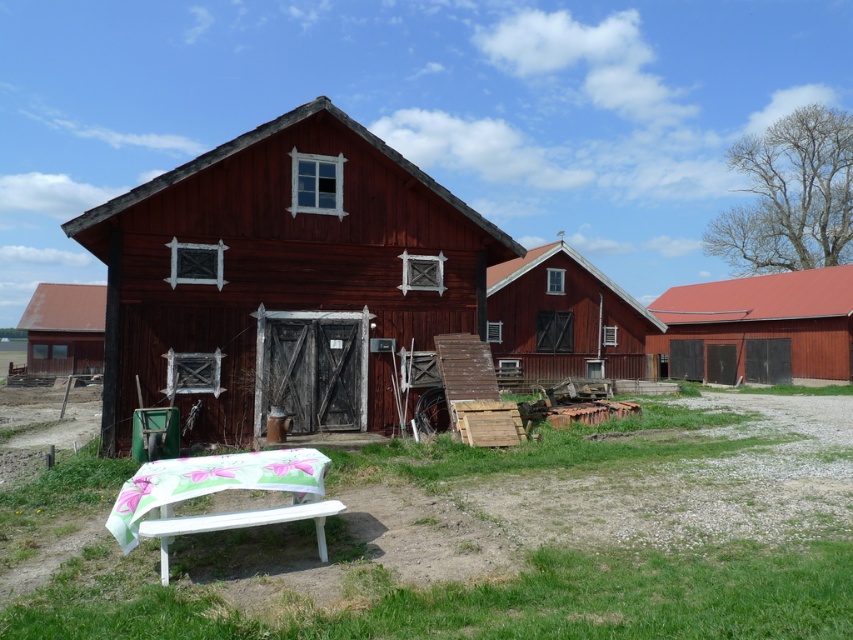
Does smooth wooden barn door at right lie behind smooth red barn at left?

No, it is not.

At what (x,y) coordinates should I click in order to perform the action: click on smooth wooden barn door at right. Please return your answer as a coordinate pair (x, y). The height and width of the screenshot is (640, 853). Looking at the image, I should click on (758, 326).

The height and width of the screenshot is (640, 853). What are the coordinates of `smooth wooden hut at center` in the screenshot? It's located at (564, 320).

Between smooth wooden hut at center and white painted wood park bench at lower left, which one appears on the right side from the viewer's perspective?

From the viewer's perspective, smooth wooden hut at center appears more on the right side.

Who is more forward, (641, 355) or (132, 529)?

Positioned in front is point (132, 529).

Locate an element on the screen. smooth wooden hut at center is located at coordinates (564, 320).

Between smooth wooden barn door at right and white painted wood park bench at lower left, which one is positioned lower?

Positioned lower is white painted wood park bench at lower left.

Is point (706, 284) in front of point (287, 451)?

No, it is not.

Find the location of a particular element. smooth wooden barn door at right is located at coordinates (758, 326).

Locate an element on the screen. The height and width of the screenshot is (640, 853). smooth wooden barn door at right is located at coordinates (758, 326).